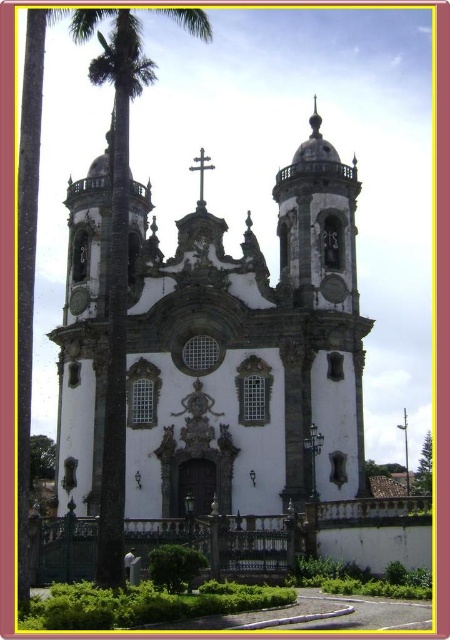
From the picture: You are standing in front of the white stone church at center and want to take a photo that includes both the church and the green leafy palm tree at left. Which object should you frame first in your camera viewfinder to ensure both are captured in the photo?

You should frame the white stone church at center first because it is larger than the green leafy palm tree at left, so it requires more space in the photo to capture its details while still including the palm tree.

You are standing in front of the church and want to take a photo that includes both the green leafy palm tree at left and the metallic cross at center. Which object will appear larger in the photo?

The green leafy palm tree at left will appear larger in the photo because it is much taller than the metallic cross at center.

You are standing in front of the church and want to place a new statue between the white stone church at center and the metallic cross at center. Based on their positions, where should the statue be placed?

The white stone church at center is below the metallic cross at center, so the statue should be placed between them vertically, positioning it above the white stone church at center and below the metallic cross at center.